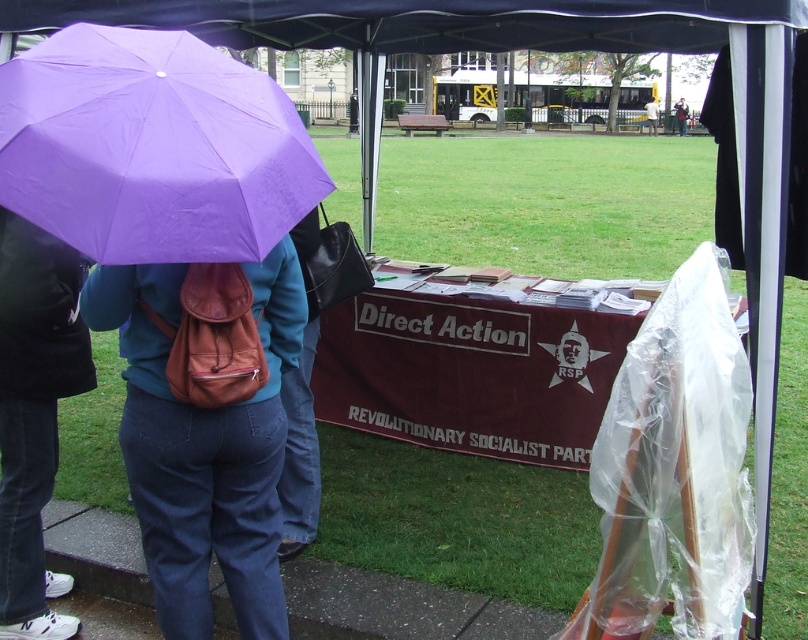
You are a photographer trying to capture a photo of the purple matte umbrella at upper left and the light brown leather jacket at upper center in the same frame. Given that your camera has a maximum focal length that allows capturing objects within 30 meters of each other, will you be able to include both objects in a single shot?

The distance between the purple matte umbrella at upper left and the light brown leather jacket at upper center is 33.06 meters, which exceeds the camera maximum focal length of 30 meters. Therefore, you cannot capture both objects in a single shot.

You are standing at the center of the image. Which direction should you look to see the purple matte umbrella at upper left?

The purple matte umbrella at upper left is located at the upper left direction from your current position at the center of the image.

Based on the scene description, what object is located at the coordinates point [152,147]?

The purple matte umbrella at upper left is located at point [152,147].